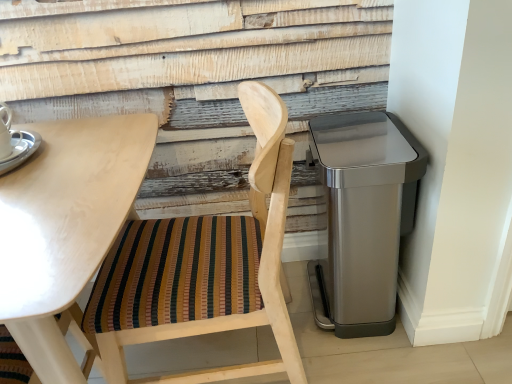
Question: From a real-world perspective, is wooden chair with striped cushion at left physically above light wood table at upper left?

Choices:
 (A) no
 (B) yes

Answer: (B)

Question: Is light wood table at upper left at the back of wooden chair with striped cushion at left?

Choices:
 (A) no
 (B) yes

Answer: (A)

Question: Are wooden chair with striped cushion at left and light wood table at upper left far apart?

Choices:
 (A) no
 (B) yes

Answer: (A)

Question: Can you confirm if wooden chair with striped cushion at left is positioned to the left of light wood table at upper left?

Choices:
 (A) yes
 (B) no

Answer: (B)

Question: From the image's perspective, is wooden chair with striped cushion at left located above light wood table at upper left?

Choices:
 (A) no
 (B) yes

Answer: (B)

Question: Considering the relative positions of wooden chair with striped cushion at left and light wood table at upper left in the image provided, is wooden chair with striped cushion at left behind light wood table at upper left?

Choices:
 (A) no
 (B) yes

Answer: (B)

Question: Can light wood table at upper left be found inside silver metallic saucer at upper left?

Choices:
 (A) yes
 (B) no

Answer: (B)

Question: From a real-world perspective, does silver metallic saucer at upper left sit lower than light wood table at upper left?

Choices:
 (A) yes
 (B) no

Answer: (B)

Question: From the image's perspective, is silver metallic saucer at upper left located above light wood table at upper left?

Choices:
 (A) no
 (B) yes

Answer: (B)

Question: Is silver metallic saucer at upper left at the left side of light wood table at upper left?

Choices:
 (A) no
 (B) yes

Answer: (B)

Question: Could you tell me if silver metallic saucer at upper left is facing light wood table at upper left?

Choices:
 (A) yes
 (B) no

Answer: (B)

Question: Is silver metallic saucer at upper left bigger than light wood table at upper left?

Choices:
 (A) no
 (B) yes

Answer: (A)

Question: From a real-world perspective, does wooden chair with striped cushion at left sit lower than silver metallic saucer at upper left?

Choices:
 (A) no
 (B) yes

Answer: (B)